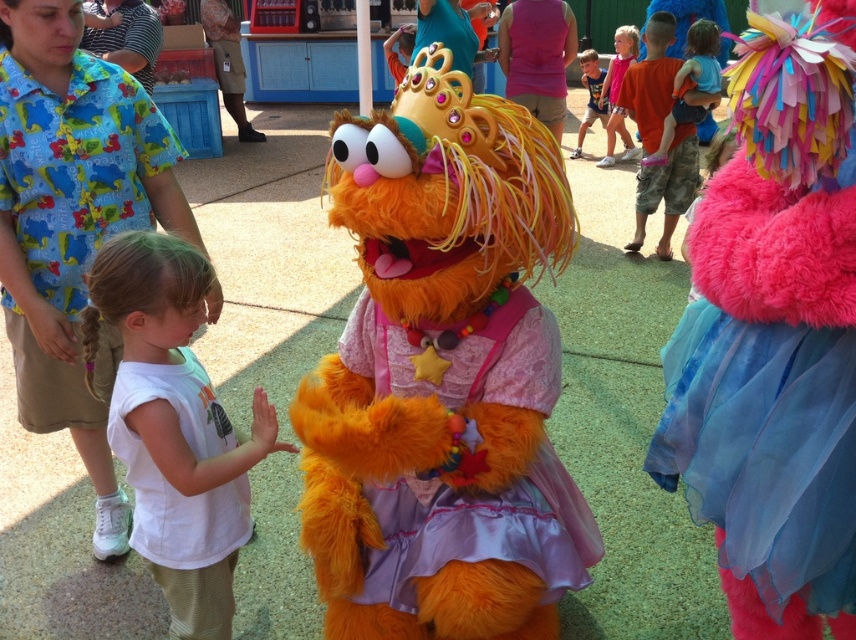
From the picture: Where is the fluffy orange fur at center located in the image?

The fluffy orange fur at center is located at point coordinates of (444, 380).

You are standing in the center of the scene and want to locate the fluffy orange fur at center. According to the coordinates provided, where exactly would you find it?

The fluffy orange fur at center is located at the coordinates point (444, 380).

What is the exact 2D coordinate of the white cotton shirt at center?

The exact 2D coordinate of the white cotton shirt at center is point (x=174, y=426).